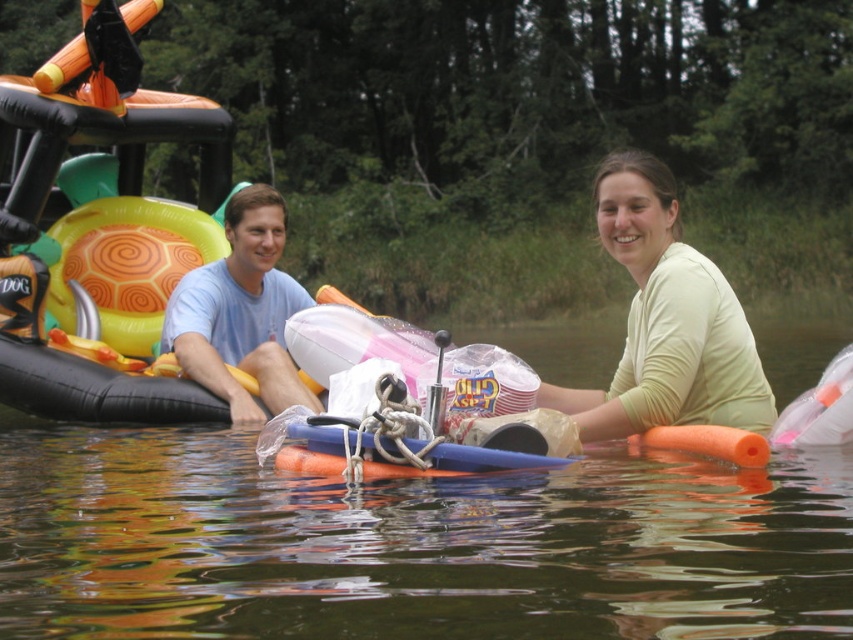
You are a hiker who has just arrived at the riverbank and wants to know which item is smaller between the light yellow fabric at center and the light blue cotton shirt at center. Can you help?

The light yellow fabric at center is smaller than the light blue cotton shirt at center, so the light yellow fabric at center is the smaller item.